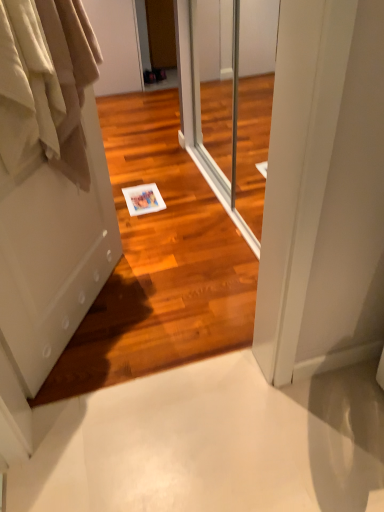
Question: Considering the positions of white matte door at left and beige cotton curtains at left in the image, is white matte door at left taller or shorter than beige cotton curtains at left?

Choices:
 (A) tall
 (B) short

Answer: (A)

Question: Is point (29, 344) closer or farther from the camera than point (49, 150)?

Choices:
 (A) farther
 (B) closer

Answer: (A)

Question: Which is farther from the transparent glass screen door at center?

Choices:
 (A) white matte door at left
 (B) beige cotton curtains at left

Answer: (B)

Question: Estimate the real-world distances between objects in this image. Which object is closer to the beige cotton curtains at left?

Choices:
 (A) transparent glass screen door at center
 (B) white matte door at left

Answer: (B)